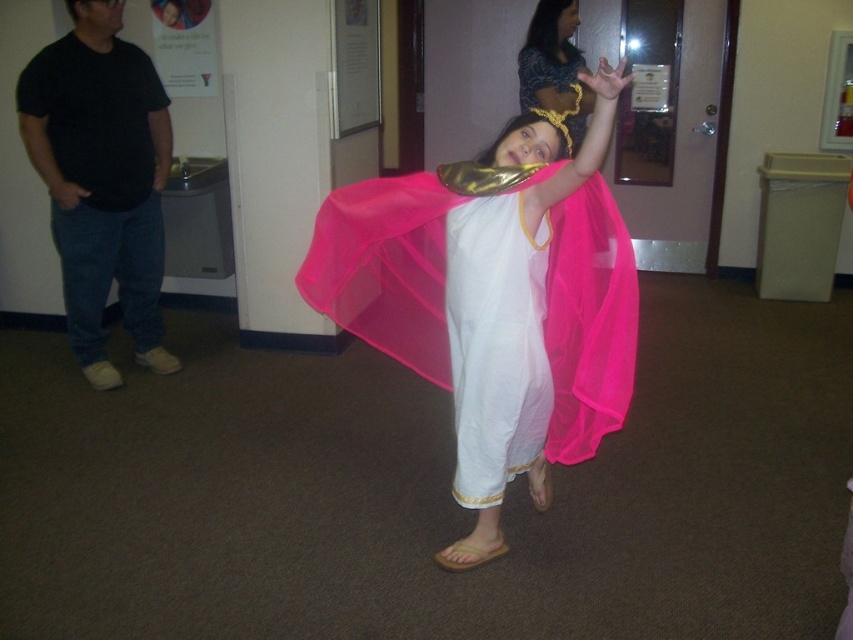
Question: Which of the following is the farthest from the observer?

Choices:
 (A) (520, 280)
 (B) (138, 116)
 (C) (457, 225)
 (D) (579, 106)

Answer: (D)

Question: Which object is the farthest from the matte pink fabric at center?

Choices:
 (A) matte black t-shirt at left
 (B) white cotton dress at center

Answer: (A)

Question: Is matte black t-shirt at left to the left of matte gold headband at upper center from the viewer's perspective?

Choices:
 (A) no
 (B) yes

Answer: (B)

Question: Is matte pink fabric at center positioned in front of matte black t-shirt at left?

Choices:
 (A) yes
 (B) no

Answer: (A)

Question: Is matte black t-shirt at left closer to camera compared to white cotton dress at center?

Choices:
 (A) no
 (B) yes

Answer: (A)

Question: Estimate the real-world distances between objects in this image. Which object is closer to the matte gold headband at upper center?

Choices:
 (A) matte pink fabric at center
 (B) white cotton dress at center
 (C) matte black t-shirt at left

Answer: (A)